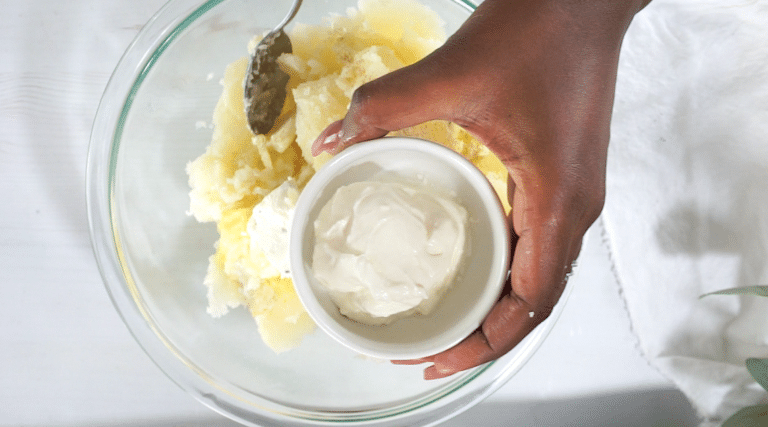
I want to click on glass, so [167, 106].